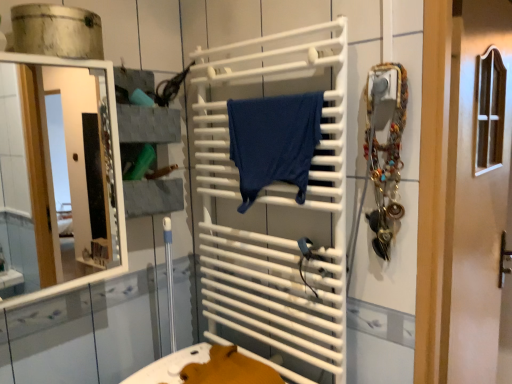
Question: From the image's perspective, is dark blue fabric at center beneath white matte towel rack at center?

Choices:
 (A) no
 (B) yes

Answer: (A)

Question: Would you say dark blue fabric at center is outside white matte towel rack at center?

Choices:
 (A) no
 (B) yes

Answer: (A)

Question: Can you confirm if dark blue fabric at center is wider than white matte towel rack at center?

Choices:
 (A) no
 (B) yes

Answer: (B)

Question: Is white matte towel rack at center inside dark blue fabric at center?

Choices:
 (A) yes
 (B) no

Answer: (B)

Question: Is dark blue fabric at center facing towards white matte towel rack at center?

Choices:
 (A) yes
 (B) no

Answer: (A)

Question: Does dark blue fabric at center have a lesser width compared to white matte towel rack at center?

Choices:
 (A) no
 (B) yes

Answer: (A)

Question: Is white glossy mirror at left positioned with its back to white glossy door at center?

Choices:
 (A) yes
 (B) no

Answer: (B)

Question: Does white glossy mirror at left turn towards white glossy door at center?

Choices:
 (A) yes
 (B) no

Answer: (B)

Question: Can you confirm if white glossy mirror at left is thinner than white glossy door at center?

Choices:
 (A) no
 (B) yes

Answer: (A)

Question: Is the position of white glossy mirror at left less distant than that of white glossy door at center?

Choices:
 (A) yes
 (B) no

Answer: (A)

Question: From a real-world perspective, is white glossy mirror at left on top of white glossy door at center?

Choices:
 (A) no
 (B) yes

Answer: (B)

Question: Is white glossy mirror at left far from white glossy door at center?

Choices:
 (A) yes
 (B) no

Answer: (A)

Question: Does white glossy door at center turn towards white matte towel rack at center?

Choices:
 (A) yes
 (B) no

Answer: (B)